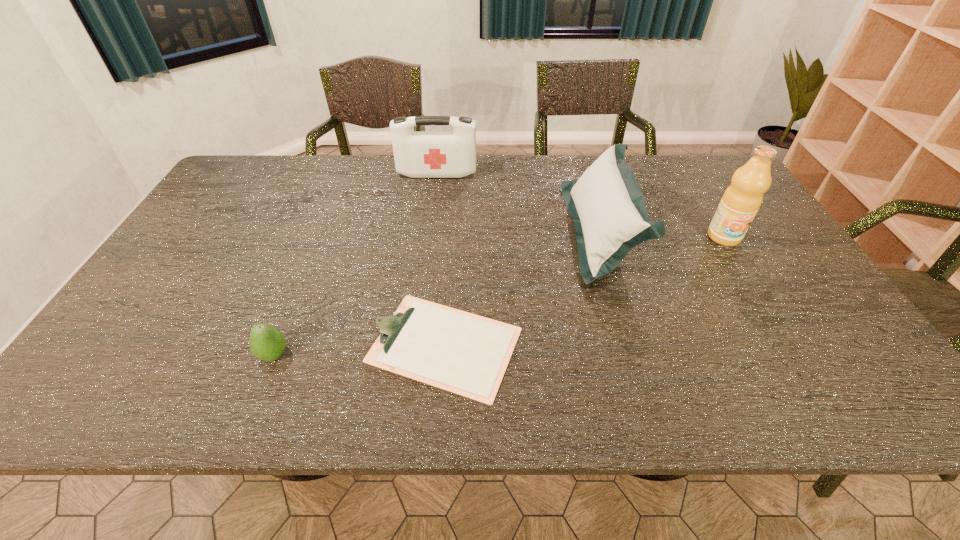
Identify the location of the rightmost object. This screenshot has height=540, width=960. (742, 199).

At what (x,y) coordinates should I click in order to perform the action: click on fruit juice. Please return your answer as a coordinate pair (x, y). The width and height of the screenshot is (960, 540). Looking at the image, I should click on (742, 199).

Locate an element on the screen. Image resolution: width=960 pixels, height=540 pixels. the first-aid kit is located at coordinates (418, 154).

What are the coordinates of `cushion` in the screenshot? It's located at tap(607, 206).

You are a GUI agent. You are given a task and a screenshot of the screen. Output one action in this format:
    pyautogui.click(x=<x>, y=<y>)
    Task: Click on the avocado
    This screenshot has height=540, width=960.
    Given the screenshot: What is the action you would take?
    pyautogui.click(x=267, y=342)

At what (x,y) coordinates should I click in order to perform the action: click on the second shortest object. Please return your answer as a coordinate pair (x, y). Image resolution: width=960 pixels, height=540 pixels. Looking at the image, I should click on (267, 342).

What are the coordinates of `the shortest object` in the screenshot? It's located at (466, 354).

Locate an element on the screen. vacant space located on the front label of the tallest object is located at coordinates (755, 287).

The width and height of the screenshot is (960, 540). What are the coordinates of `vacant space located on the front side of the first-aid kit` in the screenshot? It's located at (434, 198).

Locate an element on the screen. The width and height of the screenshot is (960, 540). vacant space located 0.260m on the surface of the fourth object from left to right is located at coordinates (479, 231).